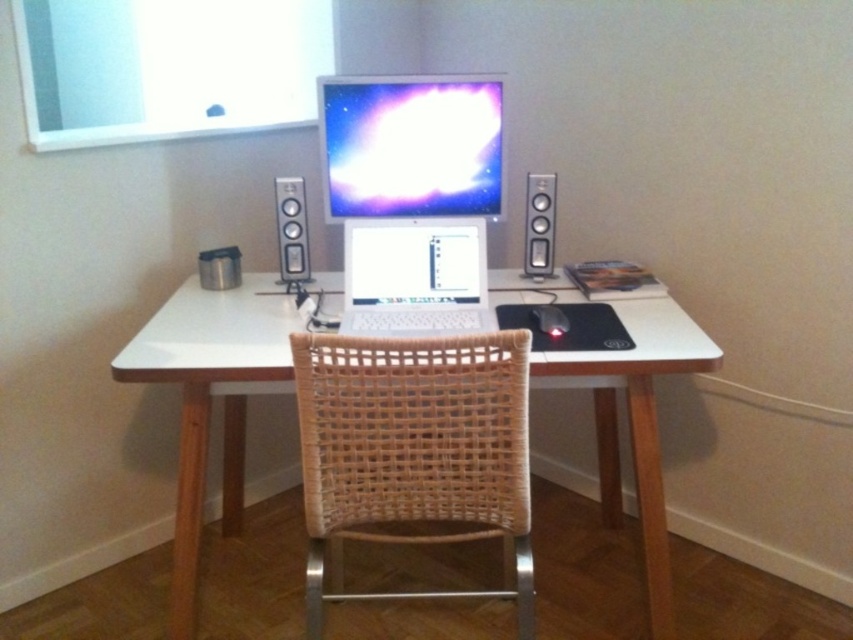
Question: Does woven wood swivel chair at center appear over satin silver speaker at right?

Choices:
 (A) no
 (B) yes

Answer: (A)

Question: Among these objects, which one is nearest to the camera?

Choices:
 (A) white wood computer desk at center
 (B) matte plastic monitor at center

Answer: (A)

Question: Does white wood computer desk at center have a smaller size compared to black matte mouse at center?

Choices:
 (A) no
 (B) yes

Answer: (A)

Question: Can you confirm if matte plastic monitor at center is bigger than silver metallic speaker at center?

Choices:
 (A) yes
 (B) no

Answer: (A)

Question: Which point is farther to the camera?

Choices:
 (A) (289, 240)
 (B) (534, 268)
 (C) (451, 148)

Answer: (B)

Question: Which point is closer to the camera taking this photo?

Choices:
 (A) (457, 188)
 (B) (196, 433)

Answer: (B)